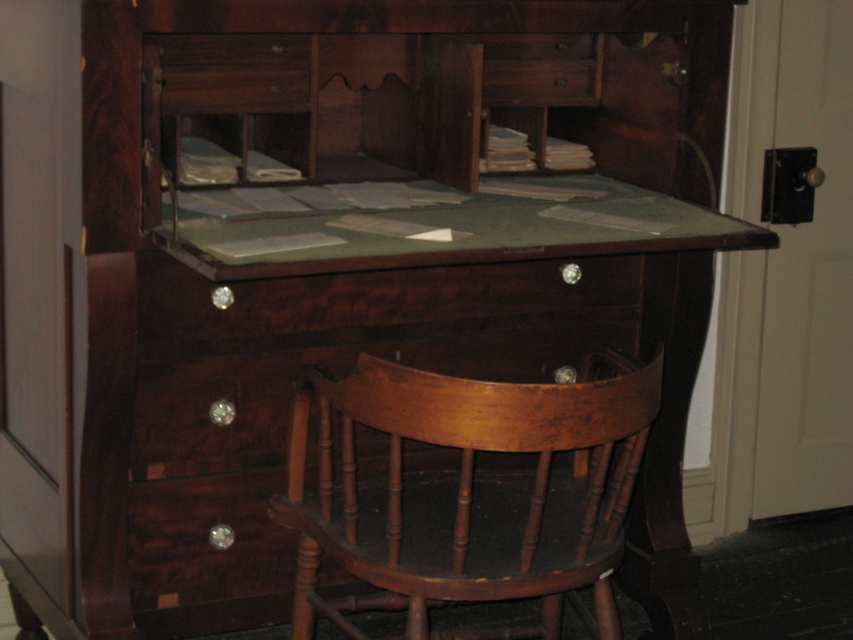
Does light brown wood chair at center have a greater width compared to shiny dark wood drawer at center?

No, light brown wood chair at center is not wider than shiny dark wood drawer at center.

Looking at this image, between light brown wood chair at center and shiny dark wood drawer at center, which one is positioned higher?

shiny dark wood drawer at center is higher up.

Locate an element on the screen. light brown wood chair at center is located at coordinates (469, 492).

Where is `light brown wood chair at center`? Image resolution: width=853 pixels, height=640 pixels. light brown wood chair at center is located at coordinates (469, 492).